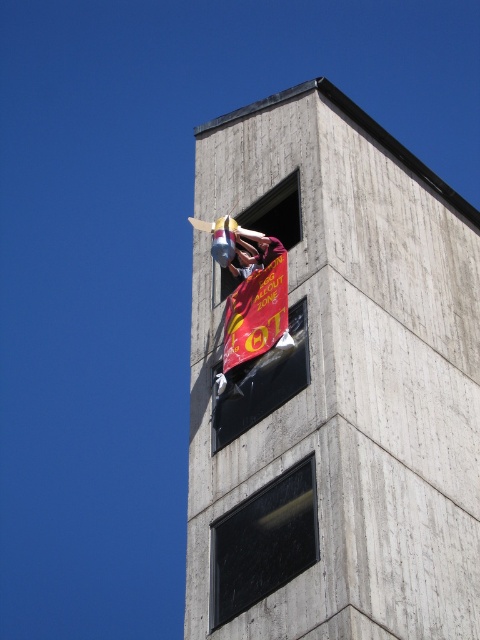
Question: Which object appears farthest from the camera in this image?

Choices:
 (A) transparent glass window at lower center
 (B) shiny metallic banner at center

Answer: (B)

Question: Does transparent glass window at lower center lie in front of shiny metallic banner at center?

Choices:
 (A) yes
 (B) no

Answer: (A)

Question: Which point appears closest to the camera in this image?

Choices:
 (A) (259, 577)
 (B) (254, 372)

Answer: (A)

Question: Is transparent glass window at lower center to the right of shiny metallic banner at center from the viewer's perspective?

Choices:
 (A) no
 (B) yes

Answer: (B)

Question: Does transparent glass window at lower center appear on the left side of shiny metallic banner at center?

Choices:
 (A) yes
 (B) no

Answer: (B)